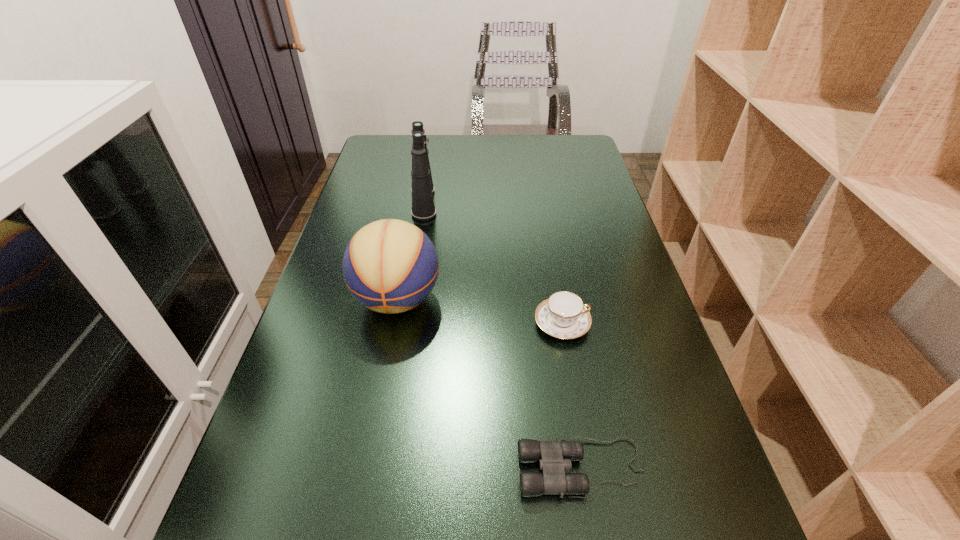
Where is `the left binoculars`? the left binoculars is located at coordinates (423, 208).

Locate an element on the screen. This screenshot has width=960, height=540. the taller binoculars is located at coordinates (423, 208).

Identify the location of basketball. (390, 266).

Locate an element on the screen. The image size is (960, 540). the third tallest object is located at coordinates (563, 315).

Identify the location of the shorter binoculars. This screenshot has height=540, width=960. (554, 457).

You are a GUI agent. You are given a task and a screenshot of the screen. Output one action in this format:
    pyautogui.click(x=<x>, y=<y>)
    Task: Click on the shortest object
    The image size is (960, 540).
    Given the screenshot: What is the action you would take?
    pyautogui.click(x=554, y=457)

This screenshot has width=960, height=540. I want to click on free space located 0.180m on the back of the farthest object, so click(431, 157).

I want to click on free spot located on the patterned surface of the basketball, so click(x=386, y=357).

The image size is (960, 540). I want to click on vacant space located on the side with the handle of the third tallest object, so click(x=656, y=323).

Locate an element on the screen. The image size is (960, 540). free space located at the eyepiece of the nearest object is located at coordinates (371, 468).